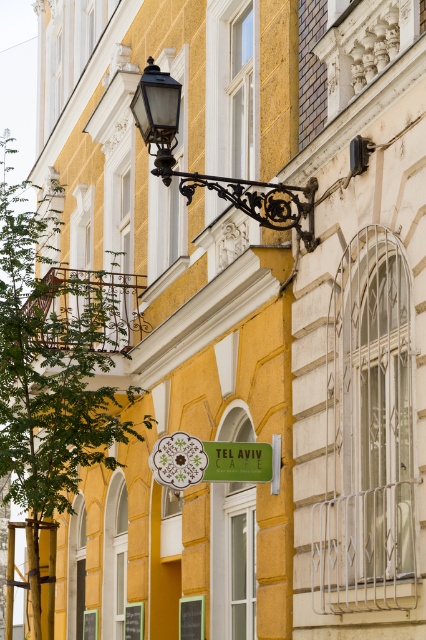
You are a delivery person carrying a 2.4 meter long package. You need to navigate between the matte black lamp at upper left and the green matte signboard at center. Can you pass through the space between them without tilting the package?

The distance between the matte black lamp at upper left and the green matte signboard at center is 2.50 meters. Since the package is 2.4 meters long, it can fit through the space without tilting.

You are a window installer who needs to determine if a new rectangular window frame that is 1.2 meters tall can fit between the matte black lamp at upper left and the green matte signboard at center. Which object is taller, and will the window frame fit vertically between them?

The matte black lamp at upper left is taller than the green matte signboard at center. Since the window frame is 1.2 meters tall, it can fit vertically between them as long as the distance between the two objects is at least 1.2 meters. However, the exact vertical spacing between the two objects isn not provided, so further measurement is needed to confirm.

You are a customer standing in front of the TEL AVIV CAFE. You see the matte black lamp at upper left and the green matte signboard at center. Which object is located to the right of the other?

The matte black lamp at upper left is positioned on the right side of green matte signboard at center.